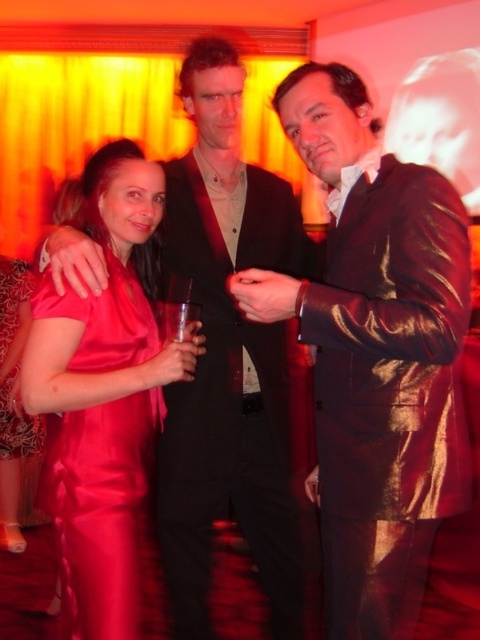
You are a photographer at this event. You need to adjust the camera focus to ensure both the matte black suit at center and the satin dress at center are in focus. Given their sizes, which object should you prioritize focusing on first to ensure depth of field accommodates both?

The matte black suit at center is larger than the satin dress at center. To ensure both are in focus, prioritize focusing on the larger matte black suit at center first, as it requires more depth of field coverage.

You are at a party and want to find the exact location of the point marked at coordinates (235, 368). Based on the scene description, where would this point be located on the person wearing the matte black suit at center?

The point at coordinates (235, 368) is located on the matte black suit at center.